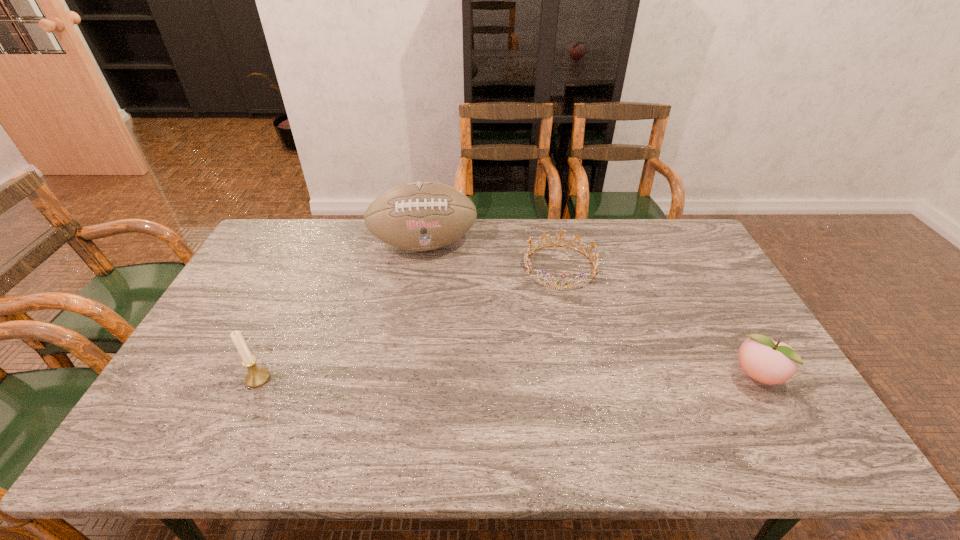
Where is `free spot on the desktop that is between the leftmost object and the rightmost object and is positioned on the front-facing side of the third object from left to right`? free spot on the desktop that is between the leftmost object and the rightmost object and is positioned on the front-facing side of the third object from left to right is located at coordinates (564, 377).

What are the coordinates of `free space on the desktop that is between the second tallest object and the rightmost object and is positioned on the laces of the third object from right to left` in the screenshot? It's located at (447, 378).